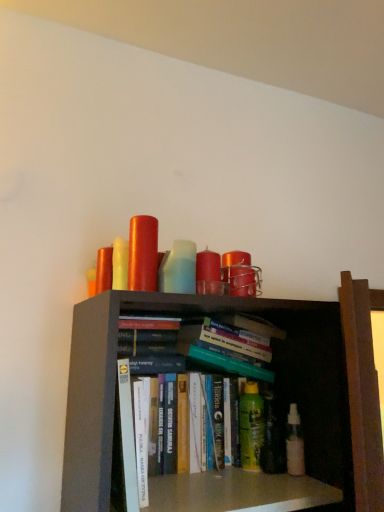
What are the coordinates of `free spot above hardcover books at center (from a real-world perspective)` in the screenshot? It's located at (185, 372).